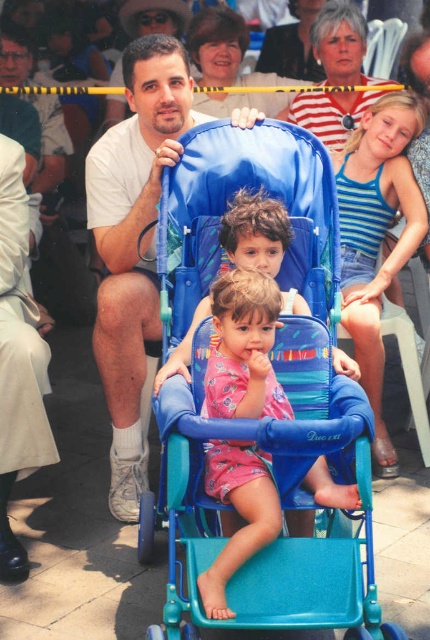
You are a photographer trying to capture a photo of the blue fabric stroller at center and the pink fabric baby at center. Since you want to frame them both in the shot, which object should you position closer to the left side of your camera viewfinder?

The pink fabric baby at center should be positioned closer to the left side of the camera viewfinder because the blue fabric stroller at center is to the right of the pink fabric baby at center.

You are a photographer trying to capture a clear shot of the pink fabric baby at center without the matte white shirt at upper left blocking it. Based on the scene description, is there a way to adjust your position to achieve this?

The matte white shirt at upper left is positioned over the pink fabric baby at center, so moving your camera angle downward or to the side might help avoid the obstruction caused by the matte white shirt at upper left.